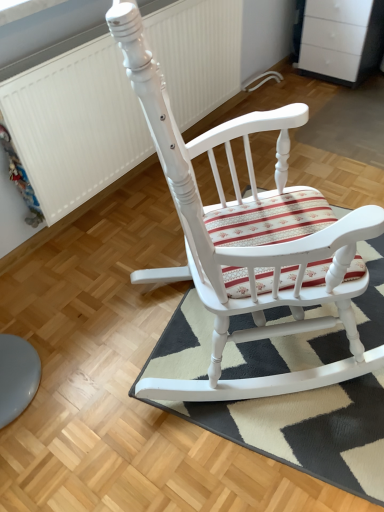
Locate an element on the screen. white painted wood rocking chair at center is located at coordinates (245, 246).

Considering the sizes of objects striped fabric doormat at center and white textured radiator at upper left in the image provided, who is bigger, striped fabric doormat at center or white textured radiator at upper left?

With larger size is white textured radiator at upper left.

Is striped fabric doormat at center turned away from white textured radiator at upper left?

striped fabric doormat at center does not have its back to white textured radiator at upper left.

Does striped fabric doormat at center have a lesser width compared to white textured radiator at upper left?

No.

How much distance is there between white textured radiator at upper left and white painted wood rocking chair at center?

They are 33.19 inches apart.

Is point (82, 54) positioned after point (153, 126)?

Yes, it is.

Do you think white textured radiator at upper left is within white painted wood rocking chair at center, or outside of it?

white textured radiator at upper left is outside white painted wood rocking chair at center.

Does white textured radiator at upper left have a smaller size compared to white painted wood rocking chair at center?

Yes, white textured radiator at upper left is smaller than white painted wood rocking chair at center.

Considering the positions of objects striped fabric doormat at center and white painted wood rocking chair at center in the image provided, who is in front, striped fabric doormat at center or white painted wood rocking chair at center?

Positioned in front is white painted wood rocking chair at center.

Do you think striped fabric doormat at center is within white painted wood rocking chair at center, or outside of it?

striped fabric doormat at center is located beyond the bounds of white painted wood rocking chair at center.

Is striped fabric doormat at center looking in the opposite direction of white painted wood rocking chair at center?

No, striped fabric doormat at center is not facing the opposite direction of white painted wood rocking chair at center.

What's the angular difference between white painted wood rocking chair at center and white textured radiator at upper left's facing directions?

The angle between the facing direction of white painted wood rocking chair at center and the facing direction of white textured radiator at upper left is 50.1 degrees.

Is point (277, 198) less distant than point (89, 86)?

That is True.

From a real-world perspective, between white painted wood rocking chair at center and white textured radiator at upper left, who is vertically higher?

From a 3D spatial view, white painted wood rocking chair at center is above.

Between white painted wood rocking chair at center and white textured radiator at upper left, which one appears on the left side from the viewer's perspective?

white textured radiator at upper left.

From a real-world perspective, is white textured radiator at upper left on striped fabric doormat at center?

Yes, from a real-world perspective, white textured radiator at upper left is above striped fabric doormat at center.

In terms of height, does white textured radiator at upper left look taller or shorter compared to striped fabric doormat at center?

Considering their sizes, white textured radiator at upper left has more height than striped fabric doormat at center.

Can you confirm if white textured radiator at upper left is bigger than striped fabric doormat at center?

Correct, white textured radiator at upper left is larger in size than striped fabric doormat at center.

Considering the sizes of white painted wood rocking chair at center and striped fabric doormat at center in the image, is white painted wood rocking chair at center wider or thinner than striped fabric doormat at center?

In the image, white painted wood rocking chair at center appears to be wider than striped fabric doormat at center.

Does white painted wood rocking chair at center turn towards striped fabric doormat at center?

No, white painted wood rocking chair at center is not oriented towards striped fabric doormat at center.

From the image's perspective, does white painted wood rocking chair at center appear higher than striped fabric doormat at center?

Indeed, from the image's perspective, white painted wood rocking chair at center is shown above striped fabric doormat at center.

Image resolution: width=384 pixels, height=512 pixels. In the image, there is a striped fabric doormat at center. What are the coordinates of `radiator above it (from the image's perspective)` in the screenshot? It's located at (75, 125).

The height and width of the screenshot is (512, 384). Identify the location of chair that appears in front of the white textured radiator at upper left. (245, 246).

Based on their spatial positions, is striped fabric doormat at center or white painted wood rocking chair at center further from white textured radiator at upper left?

Among the two, striped fabric doormat at center is located further to white textured radiator at upper left.

From the image, which object appears to be farther from white painted wood rocking chair at center, white textured radiator at upper left or striped fabric doormat at center?

Based on the image, white textured radiator at upper left appears to be further to white painted wood rocking chair at center.

From the image, which object appears to be nearer to striped fabric doormat at center, white textured radiator at upper left or white painted wood rocking chair at center?

white painted wood rocking chair at center.

Estimate the real-world distances between objects in this image. Which object is closer to striped fabric doormat at center, white painted wood rocking chair at center or white textured radiator at upper left?

white painted wood rocking chair at center lies closer to striped fabric doormat at center than the other object.

Which object lies nearer to the anchor point white painted wood rocking chair at center, striped fabric doormat at center or white textured radiator at upper left?

Among the two, striped fabric doormat at center is located nearer to white painted wood rocking chair at center.

When comparing their distances from white textured radiator at upper left, does white painted wood rocking chair at center or striped fabric doormat at center seem further?

striped fabric doormat at center is further to white textured radiator at upper left.

Identify the location of chair between white textured radiator at upper left and striped fabric doormat at center in the vertical direction. (245, 246).